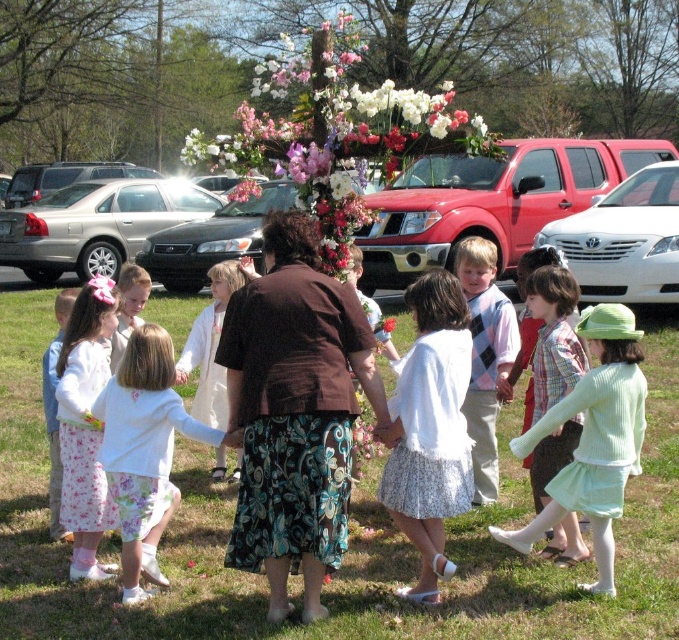
You are standing at the point labeled point [454,116] and want to see the point labeled point [534,397]. Can you see it without moving?

Point [454,116] is behind point [534,397], so you cannot see it without moving.

You are a photographer positioned at the edge of the children forming the circle. You want to take a photo that includes both the white pleated skirt at center and the white floral skirt at center. Which one will appear larger in your photo?

The white pleated skirt at center will appear larger in the photo because it is closer to the viewer than the white floral skirt at center.